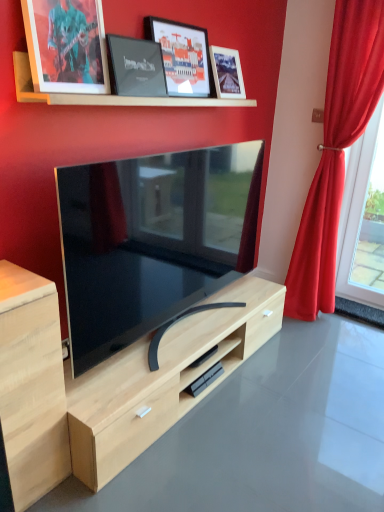
Question: Does red velvet curtain at right come behind matte glass picture frame at upper center, which is the fourth picture frame in left-to-right order?

Choices:
 (A) no
 (B) yes

Answer: (A)

Question: Does red velvet curtain at right have a larger size compared to matte glass picture frame at upper center, which is the fourth picture frame in left-to-right order?

Choices:
 (A) no
 (B) yes

Answer: (B)

Question: Does red velvet curtain at right have a greater height compared to matte glass picture frame at upper center, which is the fourth picture frame in left-to-right order?

Choices:
 (A) no
 (B) yes

Answer: (B)

Question: Does red velvet curtain at right have a smaller size compared to matte glass picture frame at upper center, which is the fourth picture frame in left-to-right order?

Choices:
 (A) no
 (B) yes

Answer: (A)

Question: Is red velvet curtain at right oriented towards matte glass picture frame at upper center, the first picture frame from the right?

Choices:
 (A) no
 (B) yes

Answer: (A)

Question: Considering the positions of red velvet curtain at right and light wood cabinet at left in the image, is red velvet curtain at right bigger or smaller than light wood cabinet at left?

Choices:
 (A) big
 (B) small

Answer: (A)

Question: From the image's perspective, is red velvet curtain at right positioned above or below light wood cabinet at left?

Choices:
 (A) above
 (B) below

Answer: (A)

Question: In terms of width, does red velvet curtain at right look wider or thinner when compared to light wood cabinet at left?

Choices:
 (A) thin
 (B) wide

Answer: (A)

Question: In terms of height, does red velvet curtain at right look taller or shorter compared to light wood cabinet at left?

Choices:
 (A) tall
 (B) short

Answer: (A)

Question: Which is correct: matte black picture frame at upper left, arranged as the 4th picture frame when viewed from the right, is inside light wood cabinet at left, or outside of it?

Choices:
 (A) outside
 (B) inside

Answer: (A)

Question: From a real-world perspective, is matte black picture frame at upper left, which is the 1th picture frame in left-to-right order, physically located above or below light wood cabinet at left?

Choices:
 (A) above
 (B) below

Answer: (A)

Question: Considering the positions of point (29, 51) and point (19, 496), is point (29, 51) closer or farther from the camera than point (19, 496)?

Choices:
 (A) closer
 (B) farther

Answer: (A)

Question: From the image's perspective, is matte black picture frame at upper left, which is the 1th picture frame in left-to-right order, above or below light wood cabinet at left?

Choices:
 (A) below
 (B) above

Answer: (B)

Question: Looking at the image, does light wood dresser at center seem bigger or smaller compared to red velvet curtain at right?

Choices:
 (A) big
 (B) small

Answer: (B)

Question: Is light wood dresser at center in front of or behind red velvet curtain at right in the image?

Choices:
 (A) front
 (B) behind

Answer: (A)